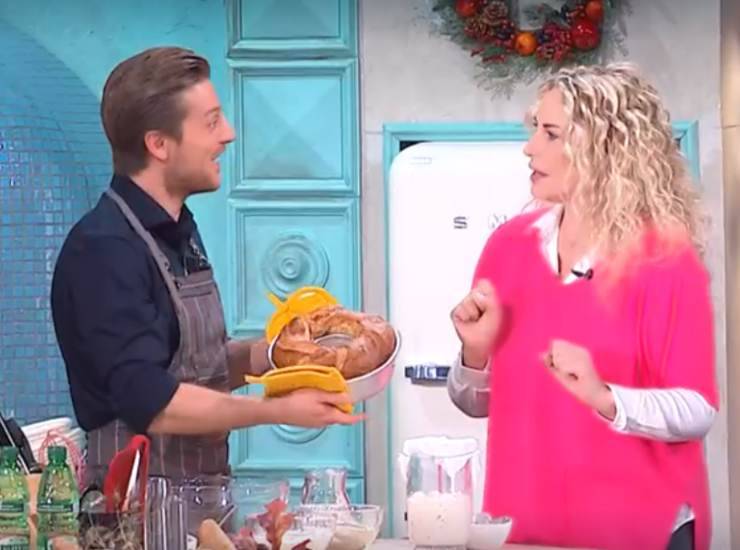
At what (x,y) coordinates should I click in order to perform the action: click on bottles. Please return your answer as a coordinate pair (x, y). Looking at the image, I should click on pos(50,471), pos(13,486).